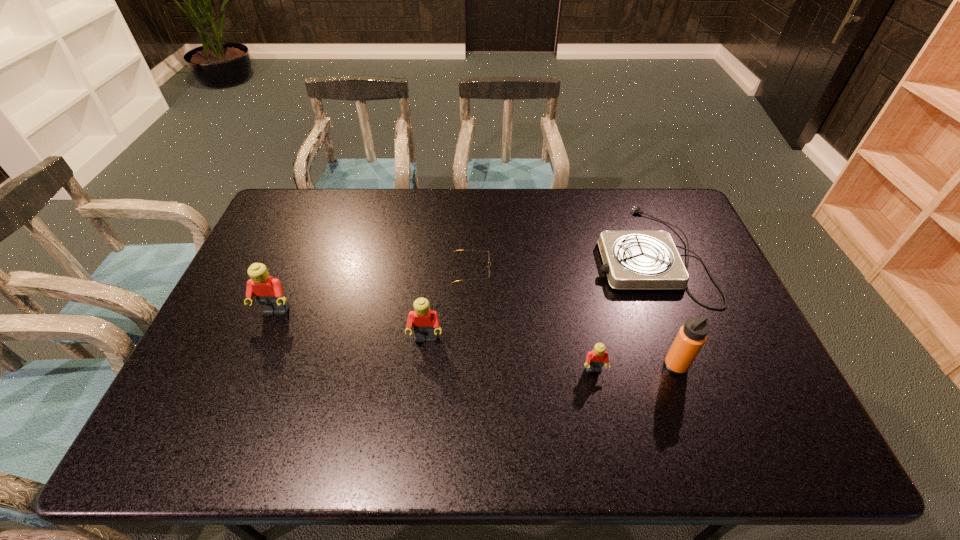
Locate an element on the screen. the leftmost object is located at coordinates (269, 294).

Locate an element on the screen. This screenshot has width=960, height=540. the farthest Lego is located at coordinates (269, 294).

Find the location of `the second Lego from right to left`. the second Lego from right to left is located at coordinates (425, 323).

The width and height of the screenshot is (960, 540). In order to click on the third nearest object in this screenshot , I will do `click(425, 323)`.

This screenshot has height=540, width=960. I want to click on the third object from right to left, so click(x=595, y=359).

Find the location of a particular element. the rightmost Lego is located at coordinates (595, 359).

The height and width of the screenshot is (540, 960). Find the location of `the fourth object from right to left`. the fourth object from right to left is located at coordinates (456, 250).

In order to click on hotplate in this screenshot , I will do [x=632, y=260].

This screenshot has height=540, width=960. I want to click on thermos bottle, so click(691, 337).

Where is `vacant space located 0.230m on the face of the leftmost object`? vacant space located 0.230m on the face of the leftmost object is located at coordinates (241, 394).